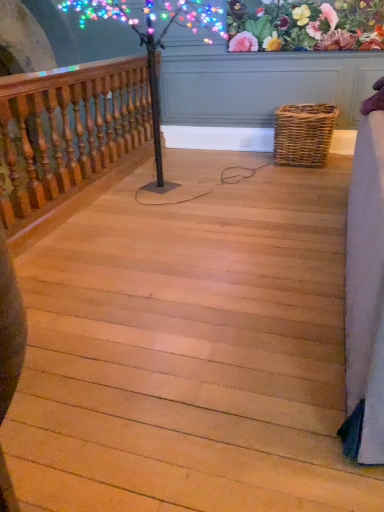
Question: Is woven brown picnic basket at lower right positioned with its back to light wood stairs at center?

Choices:
 (A) yes
 (B) no

Answer: (B)

Question: Does woven brown picnic basket at lower right have a greater height compared to light wood stairs at center?

Choices:
 (A) no
 (B) yes

Answer: (B)

Question: Does woven brown picnic basket at lower right appear on the left side of light wood stairs at center?

Choices:
 (A) no
 (B) yes

Answer: (A)

Question: Does woven brown picnic basket at lower right appear on the right side of light wood stairs at center?

Choices:
 (A) yes
 (B) no

Answer: (A)

Question: From a real-world perspective, is woven brown picnic basket at lower right located higher than light wood stairs at center?

Choices:
 (A) no
 (B) yes

Answer: (B)

Question: Is woven brown picnic basket at lower right further to camera compared to light wood stairs at center?

Choices:
 (A) yes
 (B) no

Answer: (A)

Question: Does wooden baluster at left have a greater width compared to woven brown picnic basket at lower right?

Choices:
 (A) yes
 (B) no

Answer: (B)

Question: Is wooden baluster at left thinner than woven brown picnic basket at lower right?

Choices:
 (A) no
 (B) yes

Answer: (B)

Question: Is wooden baluster at left to the left of woven brown picnic basket at lower right from the viewer's perspective?

Choices:
 (A) yes
 (B) no

Answer: (A)

Question: From the image's perspective, is wooden baluster at left on woven brown picnic basket at lower right?

Choices:
 (A) yes
 (B) no

Answer: (B)

Question: Are wooden baluster at left and woven brown picnic basket at lower right far apart?

Choices:
 (A) yes
 (B) no

Answer: (A)

Question: From a real-world perspective, is wooden baluster at left located beneath woven brown picnic basket at lower right?

Choices:
 (A) no
 (B) yes

Answer: (A)

Question: From the image's perspective, is floral fabric at upper center under wooden baluster at left?

Choices:
 (A) no
 (B) yes

Answer: (A)